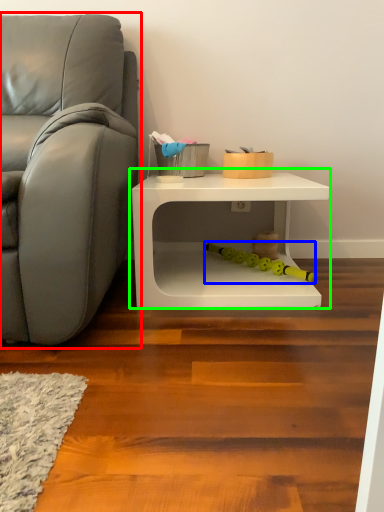
Question: Which object is the farthest from studio couch (highlighted by a red box)? Choose among these: toy (highlighted by a blue box) or table (highlighted by a green box).

Choices:
 (A) toy
 (B) table

Answer: (A)